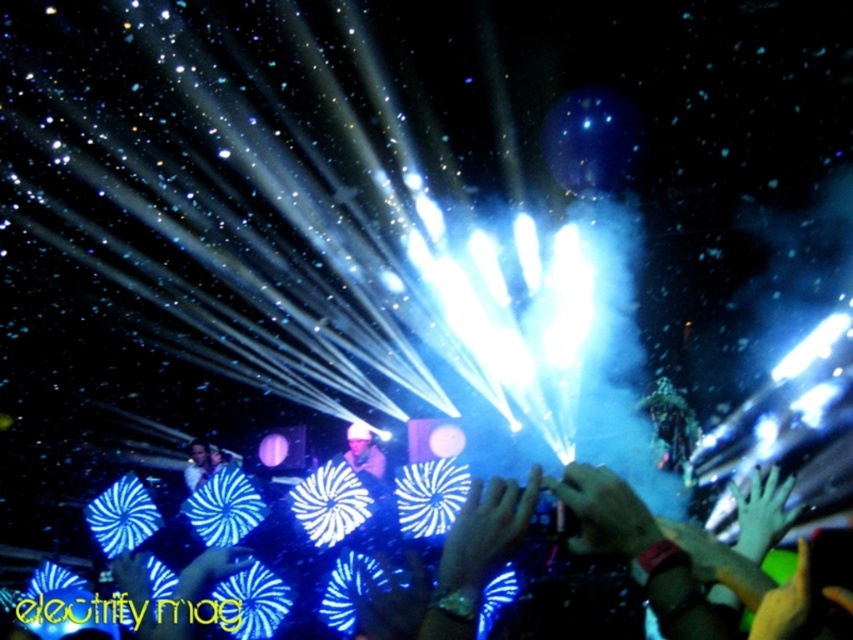
You are a stage designer planning to place a new spotlight at position coordinates 0.8, 0.5. Will the blue fabric fan at center block the light from reaching the audience area behind it?

The blue fabric fan at center is located at point (479, 550), which is slightly to the right and above the proposed spotlight position at (426, 512). Depending on the fan size and the spotlight beam angle, there might be some obstruction. However, since the coordinates are close but not overlapping, it might not fully block the light. Further details on dimensions are needed for an accurate assessment.

You are a photographer at the concert and want to capture the blue fabric fan at center and the matte black camera at center in a single shot. Which object should you focus on first to ensure both are in frame?

The blue fabric fan at center is located above the matte black camera at center, so you should focus on the matte black camera at center first to ensure both are in frame.

You are at a concert and want to find the blue fabric fan at center. Where should you look relative to the point marked at coordinate (x=479, y=550)?

The point marked at coordinate (x=479, y=550) is located on the blue fabric fan at center, so you should look directly at that point to find the fan.